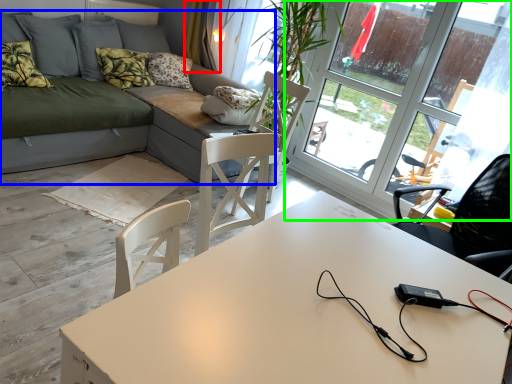
Question: Which object is positioned farthest from curtain (highlighted by a red box)? Select from studio couch (highlighted by a blue box) and window (highlighted by a green box).

Choices:
 (A) studio couch
 (B) window

Answer: (B)